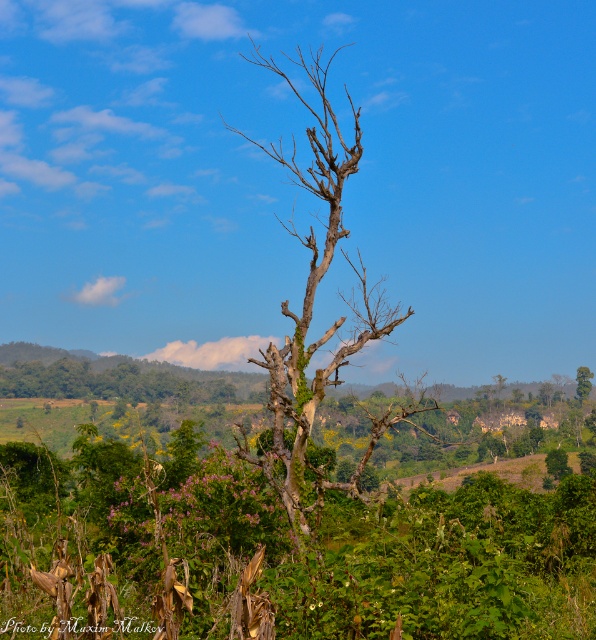
Who is positioned more to the left, bare wood tree at center or green textured tree at center?

bare wood tree at center

Measure the distance between bare wood tree at center and camera.

bare wood tree at center is 40.56 feet away from camera.

This screenshot has width=596, height=640. In order to click on bare wood tree at center in this screenshot , I will do `click(311, 316)`.